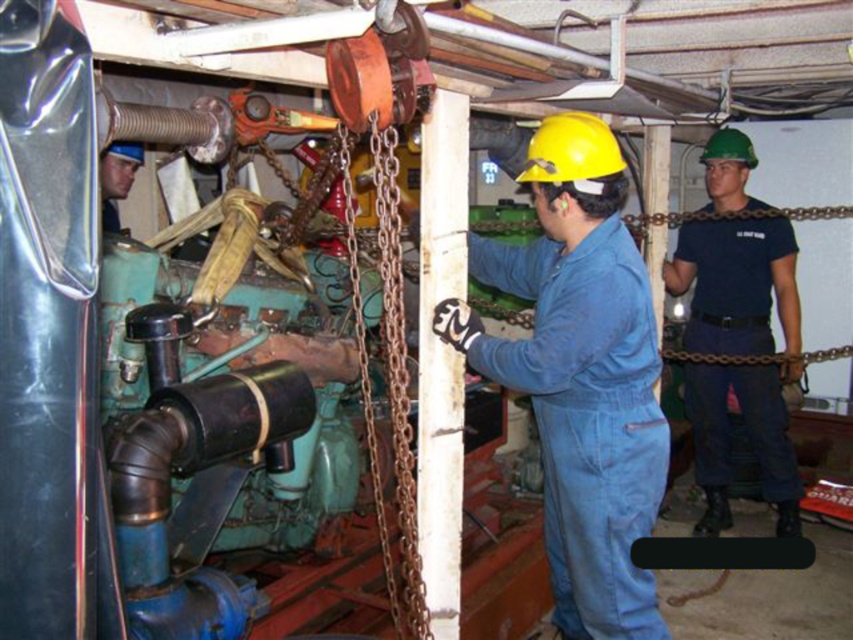
How far apart are dark blue uniform at center and matte black helmet at upper left?

A distance of 2.82 meters exists between dark blue uniform at center and matte black helmet at upper left.

Does point (724, 227) come in front of point (138, 147)?

No, (724, 227) is further to viewer.

The image size is (853, 640). I want to click on dark blue uniform at center, so click(x=735, y=284).

Image resolution: width=853 pixels, height=640 pixels. Find the location of `dark blue uniform at center`. dark blue uniform at center is located at coordinates (735, 284).

The image size is (853, 640). What do you see at coordinates (579, 376) in the screenshot?
I see `blue denim jumpsuit at center` at bounding box center [579, 376].

The image size is (853, 640). I want to click on blue denim jumpsuit at center, so pyautogui.click(x=579, y=376).

In order to click on blue denim jumpsuit at center in this screenshot , I will do `click(579, 376)`.

Is point (647, 515) closer to viewer compared to point (109, 160)?

Yes, it is.

How far apart are blue denim jumpsuit at center and matte black helmet at upper left?

They are 1.74 meters apart.

Between point (607, 288) and point (141, 157), which one is positioned in front?

Point (607, 288) is more forward.

The height and width of the screenshot is (640, 853). In order to click on blue denim jumpsuit at center in this screenshot , I will do `click(579, 376)`.